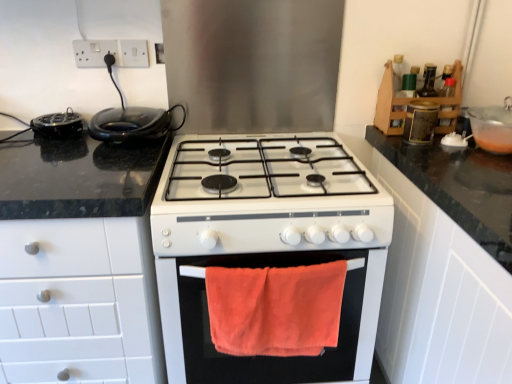
Question: Can you confirm if orange towel at center is shorter than black glossy waffle iron at left?

Choices:
 (A) no
 (B) yes

Answer: (A)

Question: From the image's perspective, is orange towel at center beneath black glossy waffle iron at left?

Choices:
 (A) no
 (B) yes

Answer: (B)

Question: Is orange towel at center smaller than black glossy waffle iron at left?

Choices:
 (A) no
 (B) yes

Answer: (A)

Question: Can you confirm if orange towel at center is thinner than black glossy waffle iron at left?

Choices:
 (A) yes
 (B) no

Answer: (A)

Question: Can you confirm if orange towel at center is wider than black glossy waffle iron at left?

Choices:
 (A) no
 (B) yes

Answer: (A)

Question: Does orange towel at center have a larger size compared to black glossy waffle iron at left?

Choices:
 (A) yes
 (B) no

Answer: (A)

Question: Is black plastic toaster at left, which is the third appliance in bottom-to-top order, facing towards orange towel at center?

Choices:
 (A) yes
 (B) no

Answer: (B)

Question: Is black plastic toaster at left, the 1th appliance when ordered from left to right, turned away from orange towel at center?

Choices:
 (A) yes
 (B) no

Answer: (B)

Question: From a real-world perspective, is black plastic toaster at left, which is the third appliance in bottom-to-top order, on orange towel at center?

Choices:
 (A) yes
 (B) no

Answer: (A)

Question: Is the position of black plastic toaster at left, marked as the 4th appliance in a right-to-left arrangement, less distant than that of orange towel at center?

Choices:
 (A) no
 (B) yes

Answer: (A)

Question: Does black plastic toaster at left, which is the third appliance in bottom-to-top order, have a smaller size compared to orange towel at center?

Choices:
 (A) yes
 (B) no

Answer: (A)

Question: Is black plastic toaster at left, which is the second appliance from top to bottom, wider than orange towel at center?

Choices:
 (A) yes
 (B) no

Answer: (A)

Question: Does metallic gold canister at upper right, which is the 2th appliance from right to left, have a greater height compared to white plastic socket at upper center, the 1th electric outlet viewed from the right?

Choices:
 (A) yes
 (B) no

Answer: (A)